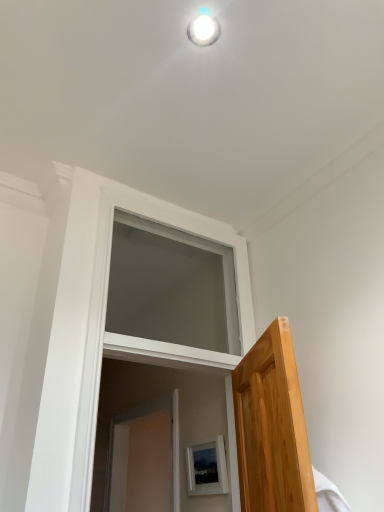
Question: Is white glossy light fixture at upper center in front of or behind white matte window at center in the image?

Choices:
 (A) front
 (B) behind

Answer: (A)

Question: Is white glossy light fixture at upper center bigger or smaller than white matte window at center?

Choices:
 (A) big
 (B) small

Answer: (B)

Question: Based on their relative distances, which object is farther from the matte white picture frame at lower center?

Choices:
 (A) white glossy light fixture at upper center
 (B) white matte window at center

Answer: (A)

Question: Which is farther from the white glossy light fixture at upper center?

Choices:
 (A) matte white picture frame at lower center
 (B) white matte window at center

Answer: (A)